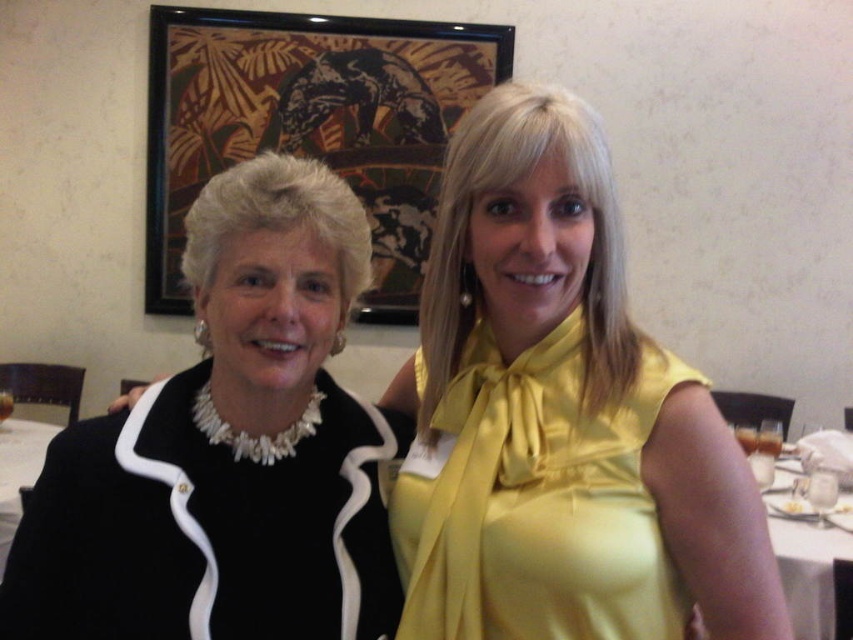
Question: Which point is closer to the camera?

Choices:
 (A) satin yellow dress at center
 (B) black satin jacket at left
 (C) yellow satin blouse at center

Answer: (B)

Question: From the image, what is the correct spatial relationship of yellow satin blouse at center in relation to satin yellow dress at center?

Choices:
 (A) left
 (B) right

Answer: (A)

Question: Which of the following is the closest to the observer?

Choices:
 (A) black satin jacket at left
 (B) satin yellow dress at center
 (C) yellow satin blouse at center

Answer: (A)

Question: Can you confirm if yellow satin blouse at center is thinner than black satin jacket at left?

Choices:
 (A) yes
 (B) no

Answer: (B)

Question: Which of these objects is positioned farthest from the yellow satin blouse at center?

Choices:
 (A) black satin jacket at left
 (B) satin yellow dress at center

Answer: (A)

Question: Can you confirm if yellow satin blouse at center is positioned below black satin jacket at left?

Choices:
 (A) yes
 (B) no

Answer: (B)